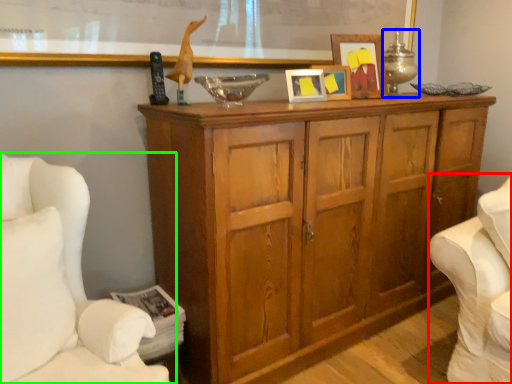
Question: Considering the real-world distances, which object is farthest from swivel chair (highlighted by a red box)? table lamp (highlighted by a blue box) or furniture (highlighted by a green box)?

Choices:
 (A) table lamp
 (B) furniture

Answer: (B)